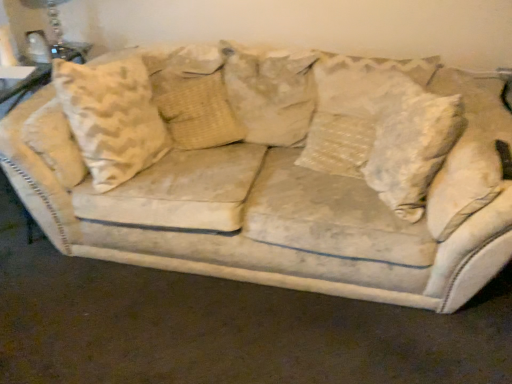
Question: Should I look upward or downward to see beige textured pillow at center, arranged as the 3th pillow when viewed from the right?

Choices:
 (A) down
 (B) up

Answer: (B)

Question: Can you confirm if white textured pillow at center, arranged as the first pillow when viewed from the right, is thinner than beige textured pillow at center, which ranks as the 1th pillow in left-to-right order?

Choices:
 (A) yes
 (B) no

Answer: (B)

Question: Are white textured pillow at center, arranged as the first pillow when viewed from the right, and beige textured pillow at center, arranged as the 3th pillow when viewed from the right, making contact?

Choices:
 (A) no
 (B) yes

Answer: (A)

Question: Is beige textured pillow at center, arranged as the 3th pillow when viewed from the right, a part of white textured pillow at center, which is counted as the 3th pillow, starting from the left?

Choices:
 (A) yes
 (B) no

Answer: (B)

Question: Does white textured pillow at center, arranged as the first pillow when viewed from the right, have a smaller size compared to beige textured pillow at center, which ranks as the 1th pillow in left-to-right order?

Choices:
 (A) yes
 (B) no

Answer: (B)

Question: From a real-world perspective, is white textured pillow at center, which is counted as the 3th pillow, starting from the left, positioned under beige textured pillow at center, which ranks as the 1th pillow in left-to-right order, based on gravity?

Choices:
 (A) no
 (B) yes

Answer: (A)

Question: Is white textured pillow at center, which is counted as the 3th pillow, starting from the left, positioned far away from beige textured pillow at center, which ranks as the 1th pillow in left-to-right order?

Choices:
 (A) yes
 (B) no

Answer: (B)

Question: Is clear glass table lamp at upper left positioned before beige fabric pillow at center, arranged as the 2th pillow when viewed from the right?

Choices:
 (A) no
 (B) yes

Answer: (A)

Question: Can you confirm if clear glass table lamp at upper left is smaller than beige fabric pillow at center, which is counted as the 2th pillow, starting from the left?

Choices:
 (A) no
 (B) yes

Answer: (B)

Question: Is clear glass table lamp at upper left facing towards beige fabric pillow at center, arranged as the 2th pillow when viewed from the right?

Choices:
 (A) yes
 (B) no

Answer: (B)

Question: From a real-world perspective, is clear glass table lamp at upper left located higher than beige fabric pillow at center, arranged as the 2th pillow when viewed from the right?

Choices:
 (A) no
 (B) yes

Answer: (B)

Question: Can you confirm if clear glass table lamp at upper left is wider than beige fabric pillow at center, which is counted as the 2th pillow, starting from the left?

Choices:
 (A) no
 (B) yes

Answer: (A)

Question: From a real-world perspective, does clear glass table lamp at upper left sit lower than beige fabric pillow at center, which is counted as the 2th pillow, starting from the left?

Choices:
 (A) no
 (B) yes

Answer: (A)

Question: Is beige textured pillow at center, which ranks as the 1th pillow in left-to-right order, placed right next to clear glass table lamp at upper left?

Choices:
 (A) yes
 (B) no

Answer: (B)